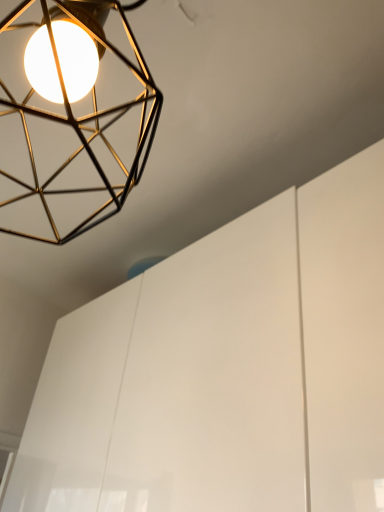
In order to click on gold wireframe lamp at upper left in this screenshot , I will do `click(71, 117)`.

What is the approximate height of gold wireframe lamp at upper left?

gold wireframe lamp at upper left is 51.77 centimeters tall.

The image size is (384, 512). What do you see at coordinates (71, 117) in the screenshot?
I see `gold wireframe lamp at upper left` at bounding box center [71, 117].

Image resolution: width=384 pixels, height=512 pixels. Identify the location of white glossy cabinet at upper center. (227, 369).

What do you see at coordinates (227, 369) in the screenshot? Image resolution: width=384 pixels, height=512 pixels. I see `white glossy cabinet at upper center` at bounding box center [227, 369].

Measure the distance between white glossy cabinet at upper center and camera.

They are 18.47 inches apart.

The height and width of the screenshot is (512, 384). In order to click on gold wireframe lamp at upper left in this screenshot , I will do `click(71, 117)`.

From the picture: Which is more to the left, gold wireframe lamp at upper left or white glossy cabinet at upper center?

gold wireframe lamp at upper left is more to the left.

Between gold wireframe lamp at upper left and white glossy cabinet at upper center, which one is positioned behind?

white glossy cabinet at upper center is behind.

Does point (44, 50) lie in front of point (314, 338)?

That is True.

From the image's perspective, which object appears higher, gold wireframe lamp at upper left or white glossy cabinet at upper center?

gold wireframe lamp at upper left is shown above in the image.

From a real-world perspective, is gold wireframe lamp at upper left over white glossy cabinet at upper center?

Indeed, from a real-world perspective, gold wireframe lamp at upper left stands above white glossy cabinet at upper center.

Does gold wireframe lamp at upper left have a greater width compared to white glossy cabinet at upper center?

No, gold wireframe lamp at upper left is not wider than white glossy cabinet at upper center.

From their relative heights in the image, would you say gold wireframe lamp at upper left is taller or shorter than white glossy cabinet at upper center?

Considering their sizes, gold wireframe lamp at upper left has less height than white glossy cabinet at upper center.

Can you confirm if gold wireframe lamp at upper left is smaller than white glossy cabinet at upper center?

Indeed, gold wireframe lamp at upper left has a smaller size compared to white glossy cabinet at upper center.

Is white glossy cabinet at upper center surrounded by gold wireframe lamp at upper left?

That's incorrect, white glossy cabinet at upper center is not inside gold wireframe lamp at upper left.

Are gold wireframe lamp at upper left and white glossy cabinet at upper center beside each other?

No.

Could you tell me if gold wireframe lamp at upper left is facing white glossy cabinet at upper center?

No, gold wireframe lamp at upper left is not aimed at white glossy cabinet at upper center.

How many degrees apart are the facing directions of gold wireframe lamp at upper left and white glossy cabinet at upper center?

gold wireframe lamp at upper left and white glossy cabinet at upper center are facing 89 degrees away from each other.

Measure the distance between gold wireframe lamp at upper left and white glossy cabinet at upper center.

The distance of gold wireframe lamp at upper left from white glossy cabinet at upper center is 39.58 centimeters.

The image size is (384, 512). What are the coordinates of `lamp that is on the left side of white glossy cabinet at upper center` in the screenshot? It's located at (71, 117).

Consider the image. Between white glossy cabinet at upper center and gold wireframe lamp at upper left, which one appears on the left side from the viewer's perspective?

gold wireframe lamp at upper left.

From the picture: Considering the positions of objects white glossy cabinet at upper center and gold wireframe lamp at upper left in the image provided, who is in front, white glossy cabinet at upper center or gold wireframe lamp at upper left?

Positioned in front is gold wireframe lamp at upper left.

Is point (123, 447) farther from camera compared to point (96, 211)?

That is False.

From the image's perspective, is white glossy cabinet at upper center positioned above or below gold wireframe lamp at upper left?

white glossy cabinet at upper center is below gold wireframe lamp at upper left.

From a real-world perspective, is white glossy cabinet at upper center positioned above or below gold wireframe lamp at upper left?

white glossy cabinet at upper center is below gold wireframe lamp at upper left.

Considering the sizes of objects white glossy cabinet at upper center and gold wireframe lamp at upper left in the image provided, who is wider, white glossy cabinet at upper center or gold wireframe lamp at upper left?

Wider between the two is white glossy cabinet at upper center.

Between white glossy cabinet at upper center and gold wireframe lamp at upper left, which one has more height?

With more height is white glossy cabinet at upper center.

Between white glossy cabinet at upper center and gold wireframe lamp at upper left, which one has smaller size?

gold wireframe lamp at upper left is smaller.

Is white glossy cabinet at upper center surrounding gold wireframe lamp at upper left?

No, gold wireframe lamp at upper left is located outside of white glossy cabinet at upper center.

Are white glossy cabinet at upper center and gold wireframe lamp at upper left far apart?

No, white glossy cabinet at upper center is not far from gold wireframe lamp at upper left.

Is white glossy cabinet at upper center turned away from gold wireframe lamp at upper left?

white glossy cabinet at upper center is not turned away from gold wireframe lamp at upper left.

Can you tell me how much white glossy cabinet at upper center and gold wireframe lamp at upper left differ in facing direction?

The angular difference between white glossy cabinet at upper center and gold wireframe lamp at upper left is 89 degrees.

Locate an element on the screen. lamp to the left of white glossy cabinet at upper center is located at coordinates (71, 117).

Where is `cabinetry below the gold wireframe lamp at upper left (from the image's perspective)`? Image resolution: width=384 pixels, height=512 pixels. cabinetry below the gold wireframe lamp at upper left (from the image's perspective) is located at coordinates (227, 369).

The image size is (384, 512). I want to click on cabinetry on the right of gold wireframe lamp at upper left, so click(x=227, y=369).